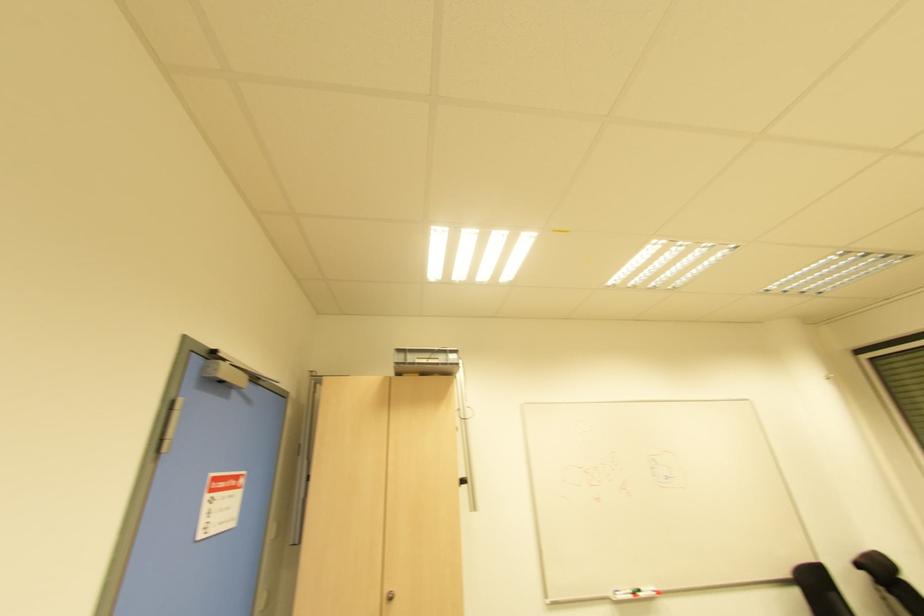
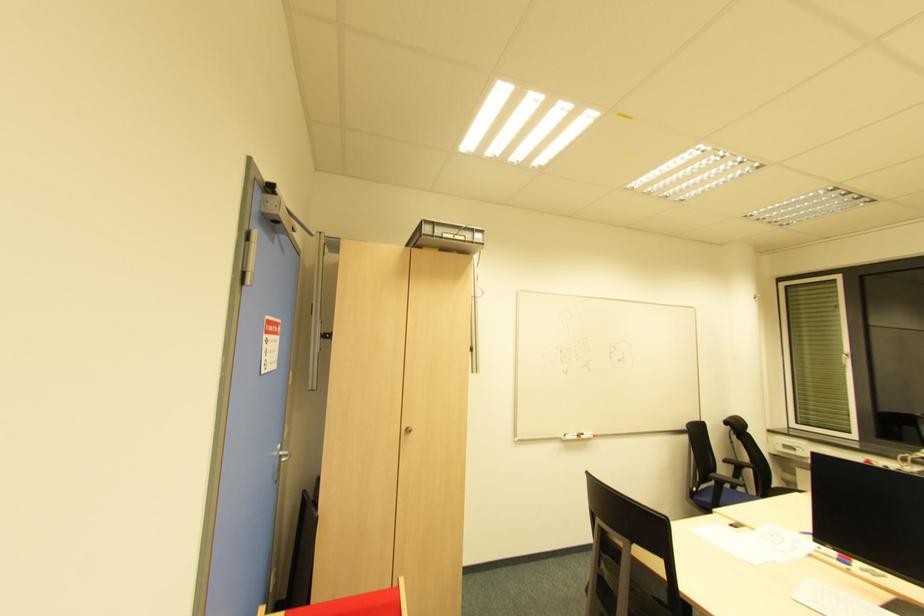
Question: Which direction would the cameraman need to move to produce the second image? Reply with the corresponding letter.

Choices:
 (A) Left
 (B) Right
 (C) Forward
 (D) Backward

Answer: (A)